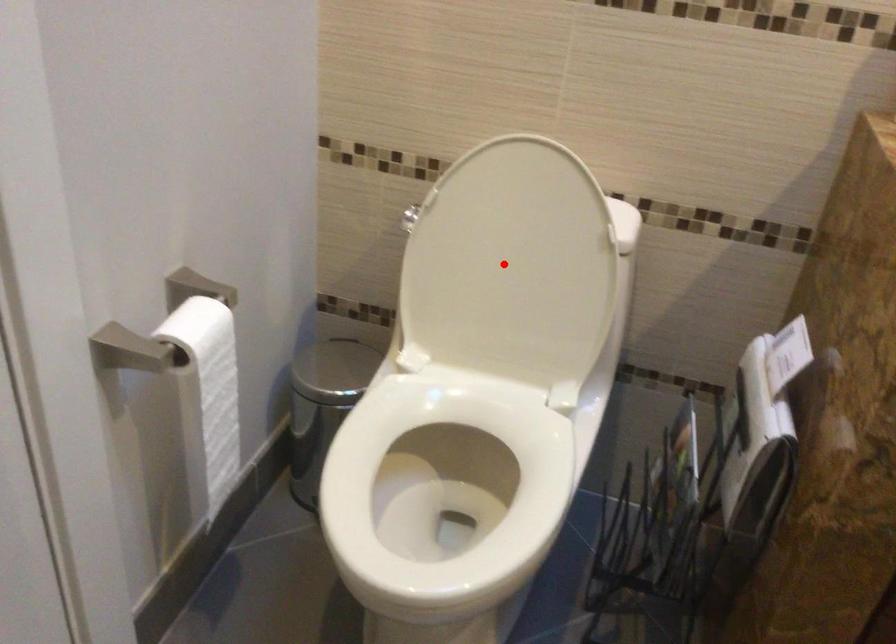
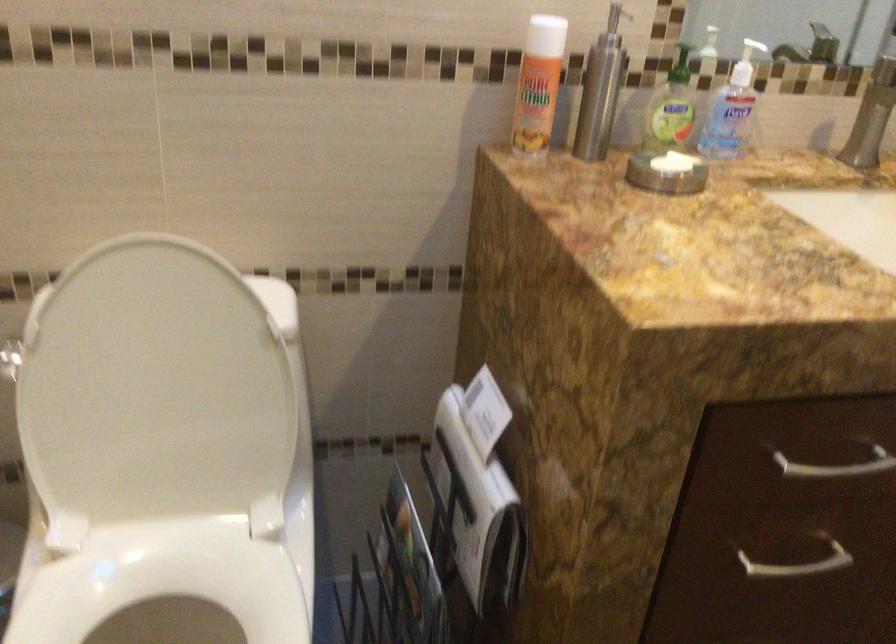
Where in the second image is the point corresponding to the highlighted location from the first image?

(152, 391)